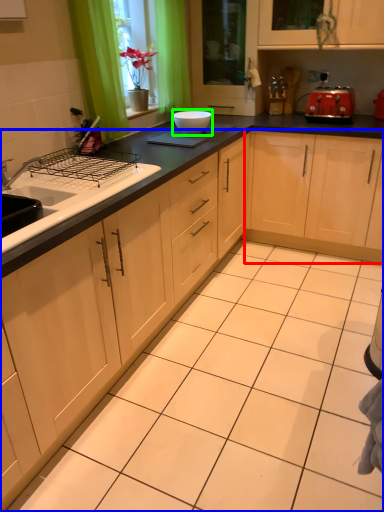
Question: Which object is positioned farthest from cabinetry (highlighted by a red box)? Select from cabinetry (highlighted by a blue box) and bowl (highlighted by a green box).

Choices:
 (A) cabinetry
 (B) bowl

Answer: (A)